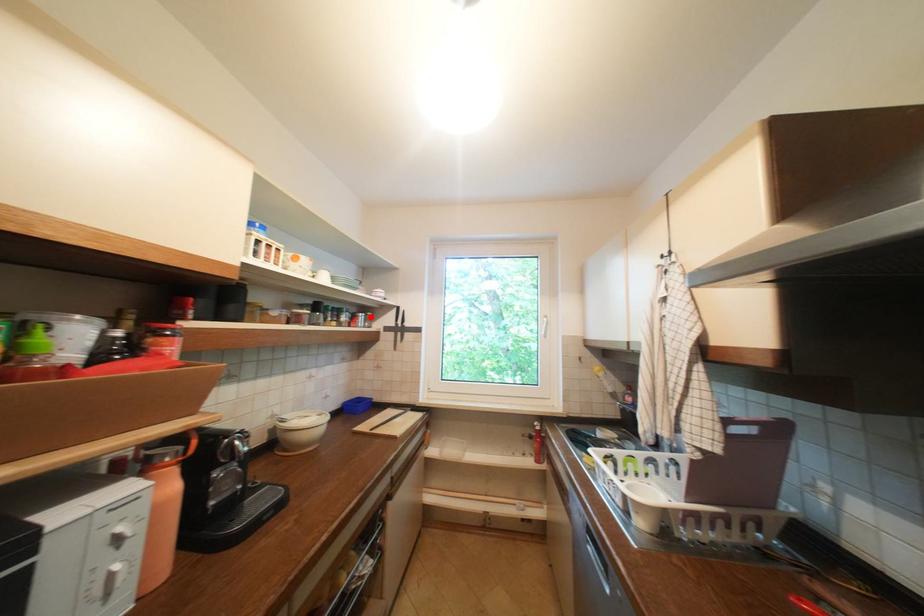
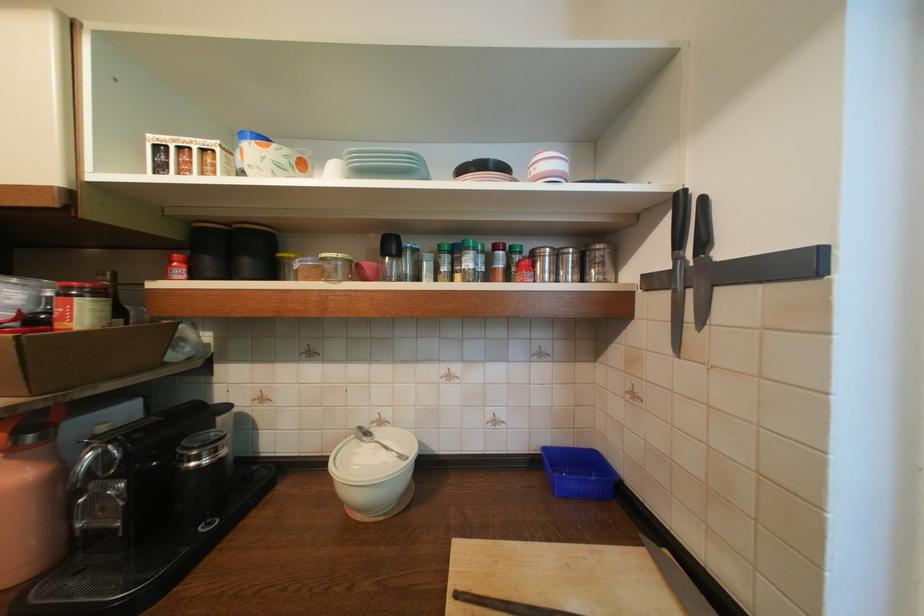
Where in the second image is the point corresponding to the highlighted location from the first image?

(565, 256)